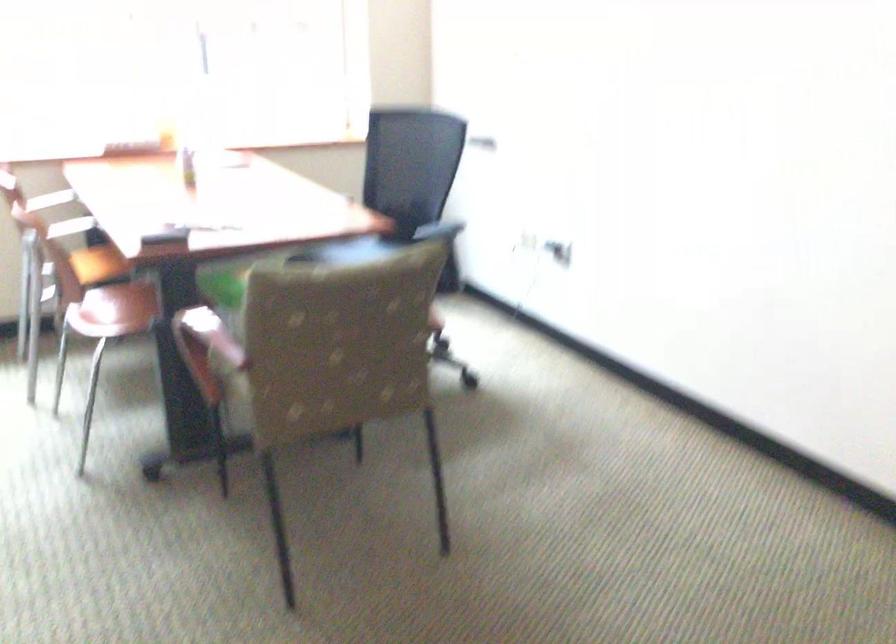
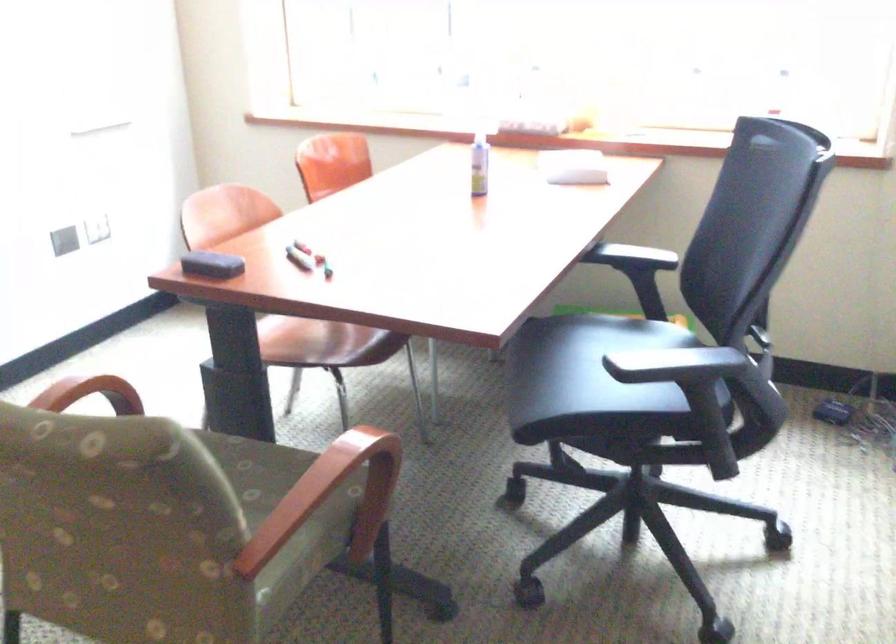
Where in the second image is the point corresponding to the point at 192,153 from the first image?

(478, 164)